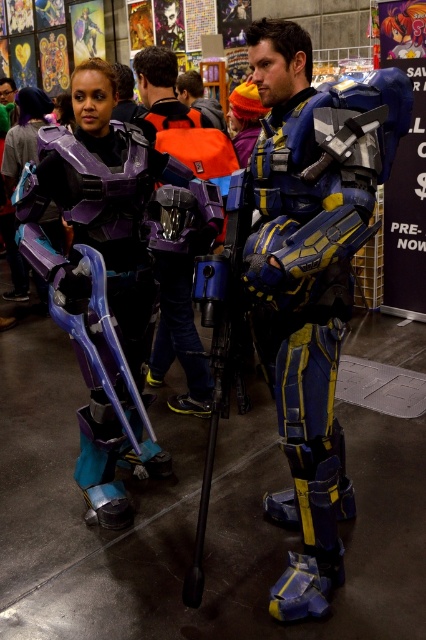
Question: Does shiny blue armor at center appear on the right side of metallic blue armor at center?

Choices:
 (A) no
 (B) yes

Answer: (A)

Question: Estimate the real-world distances between objects in this image. Which object is closer to the matte purple armor at left?

Choices:
 (A) blue metallic armor at center
 (B) shiny blue armor at center
 (C) metallic blue armor at center
 (D) matte black armor at center

Answer: (B)

Question: In this image, where is blue metallic armor at center located relative to matte purple armor at left?

Choices:
 (A) above
 (B) below

Answer: (B)

Question: Is matte purple armor at left positioned behind matte black armor at center?

Choices:
 (A) no
 (B) yes

Answer: (A)

Question: Which point appears closest to the camera in this image?

Choices:
 (A) (183, 100)
 (B) (31, 129)
 (C) (164, 314)

Answer: (C)

Question: Which of the following is the farthest from the observer?

Choices:
 (A) shiny blue armor at center
 (B) matte black armor at center
 (C) blue metallic armor at center

Answer: (B)